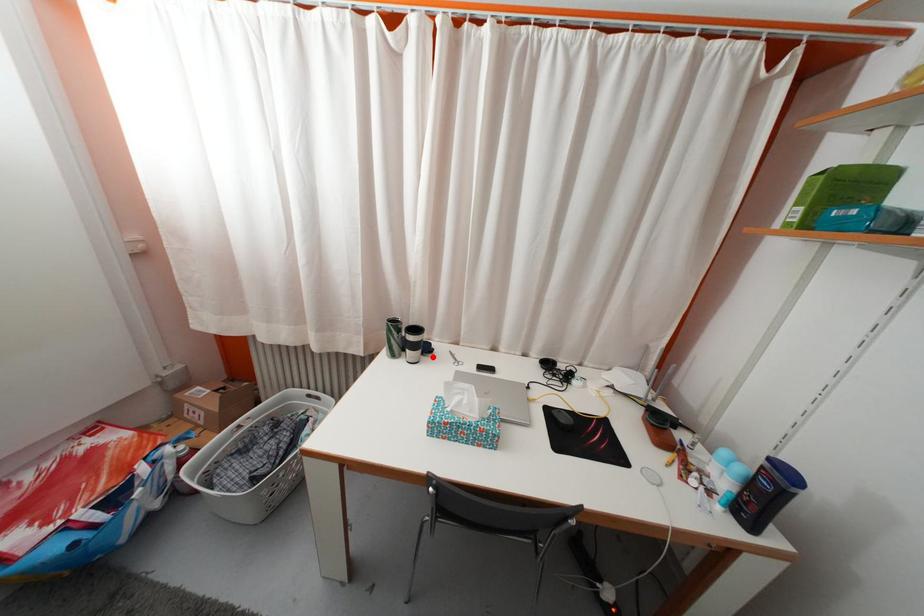
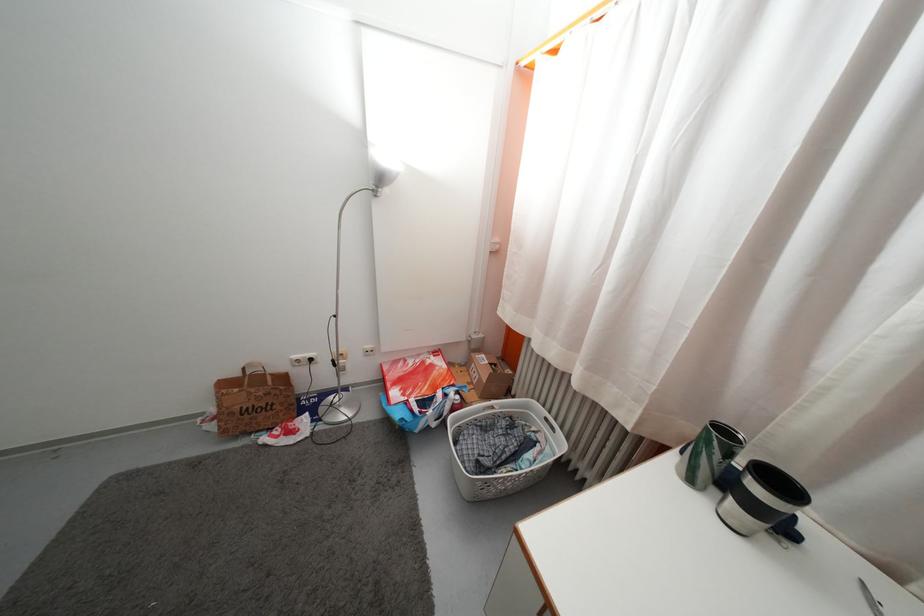
In the second image, find the point that corresponds to the highlighted location in the first image.

(791, 537)